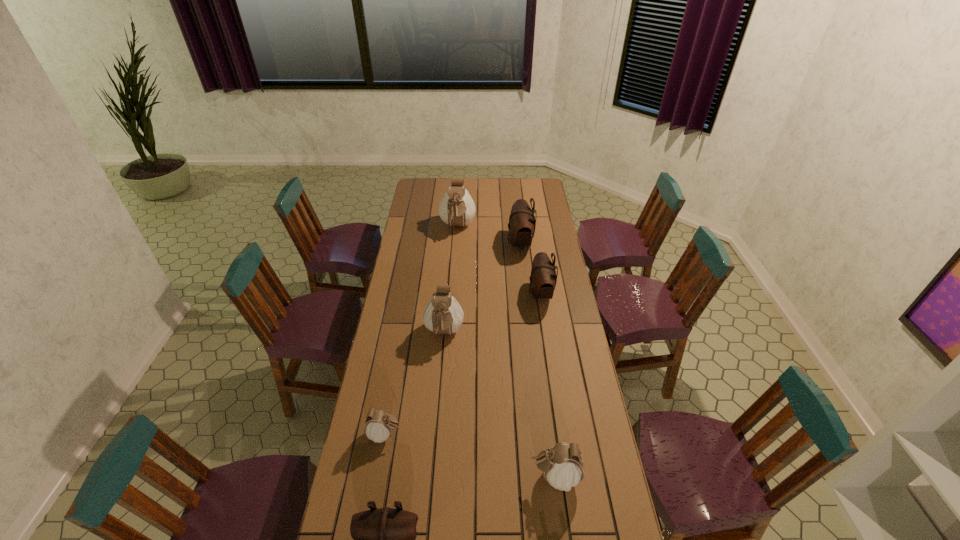
Identify the location of the biggest white pouch. (457, 208).

Locate an element on the screen. The width and height of the screenshot is (960, 540). the biggest brown pouch is located at coordinates (522, 222).

Locate an element on the screen. the fourth nearest object is located at coordinates (442, 315).

The height and width of the screenshot is (540, 960). What are the coordinates of `the second biggest white pouch` in the screenshot? It's located at (442, 315).

Where is `the second biggest brown pouch`? Image resolution: width=960 pixels, height=540 pixels. the second biggest brown pouch is located at coordinates (543, 278).

I want to click on the second nearest brown pouch, so click(543, 278).

Locate an element on the screen. This screenshot has width=960, height=540. the sixth farthest pouch is located at coordinates (562, 464).

Where is `the rightmost white pouch`? The height and width of the screenshot is (540, 960). the rightmost white pouch is located at coordinates (562, 464).

Where is `the leftmost white pouch`? the leftmost white pouch is located at coordinates (378, 427).

Image resolution: width=960 pixels, height=540 pixels. I want to click on the fifth farthest pouch, so click(x=378, y=427).